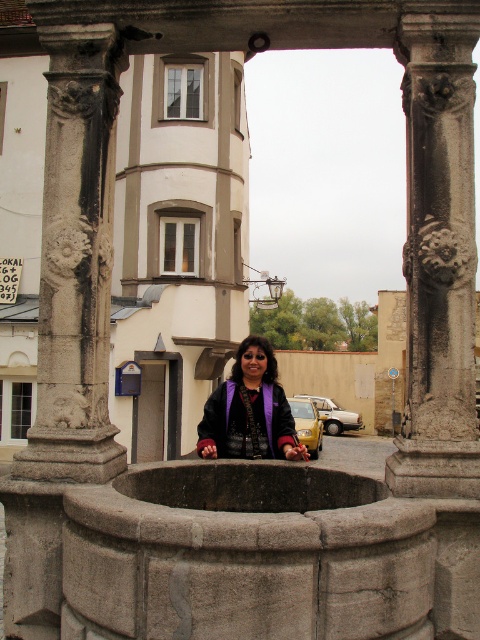
Which of these two, carved stone column at right or purple fabric at center, stands shorter?

Standing shorter between the two is purple fabric at center.

Can you confirm if carved stone column at right is positioned to the left of purple fabric at center?

No, carved stone column at right is not to the left of purple fabric at center.

Who is more forward, (457, 246) or (252, 412)?

Point (457, 246) is in front.

Find the location of `carved stone column at right`. carved stone column at right is located at coordinates (439, 259).

Does carved stone column at right appear over carved stone column at left?

Actually, carved stone column at right is below carved stone column at left.

Which is behind, point (430, 280) or point (109, 476)?

Point (109, 476)

The width and height of the screenshot is (480, 640). I want to click on carved stone column at right, so click(x=439, y=259).

Between point (222, 442) and point (304, 413), which one is positioned in front?

Point (222, 442) is more forward.

Does purple fabric at center have a smaller size compared to yellow matte car at center?

Yes, purple fabric at center is smaller than yellow matte car at center.

Where is `purple fabric at center`? The width and height of the screenshot is (480, 640). purple fabric at center is located at coordinates (250, 410).